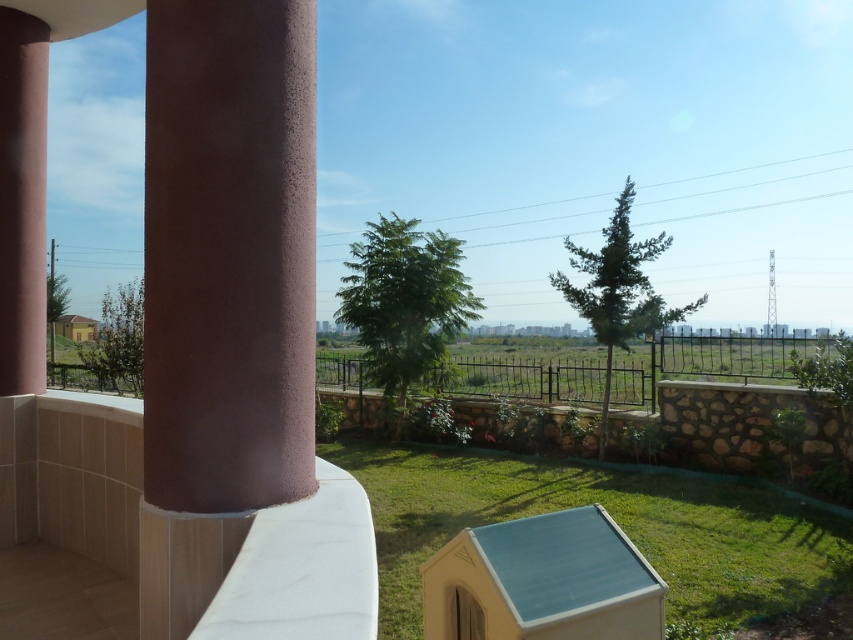
You are standing on the balcony and want to place a 2.5 meter long wooden bench between the sandy pink concrete pillar at left and the matte pink column at left. Is there enough space for the bench?

The distance between the sandy pink concrete pillar at left and the matte pink column at left is 3.09 meters. Since the bench is 2.5 meters long, there is sufficient space to place it between them.

Looking at this image, you are standing on the balcony and notice two columns on your left side. Which one is positioned further to the right between the sandy pink concrete pillar at left and the matte pink column at left?

The sandy pink concrete pillar at left is positioned further to the right compared to the matte pink column at left.

You are standing on the balcony and want to place a small potted plant exactly at the coordinates given for the sandy pink concrete pillar at left. Can you confirm the coordinates where you should place the plant?

The coordinates for the sandy pink concrete pillar at left are at point [228,253], so you should place the plant there.